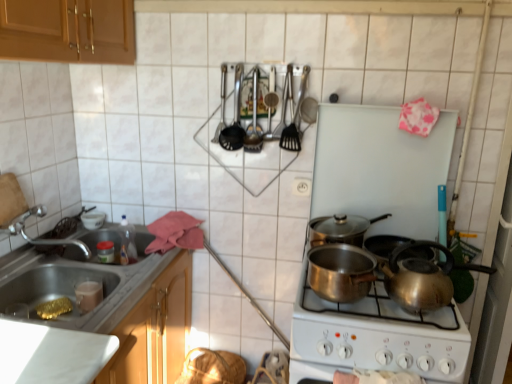
Question: Can you confirm if polished copper pot at center, which ranks as the 2th kitchen appliance in top-to-bottom order, is smaller than metallic cooking utensils at upper center?

Choices:
 (A) yes
 (B) no

Answer: (B)

Question: From a real-world perspective, is polished copper pot at center, which ranks as the 2th kitchen appliance in top-to-bottom order, positioned over metallic cooking utensils at upper center based on gravity?

Choices:
 (A) no
 (B) yes

Answer: (A)

Question: Is polished copper pot at center, the first kitchen appliance ordered from the bottom, not near metallic cooking utensils at upper center?

Choices:
 (A) yes
 (B) no

Answer: (B)

Question: Is polished copper pot at center, which ranks as the 2th kitchen appliance in top-to-bottom order, at the left side of metallic cooking utensils at upper center?

Choices:
 (A) no
 (B) yes

Answer: (A)

Question: Is metallic cooking utensils at upper center a part of polished copper pot at center, the first kitchen appliance ordered from the bottom?

Choices:
 (A) no
 (B) yes

Answer: (A)

Question: Does polished copper pot at center, which ranks as the 2th kitchen appliance in top-to-bottom order, have a greater height compared to metallic cooking utensils at upper center?

Choices:
 (A) no
 (B) yes

Answer: (A)

Question: From the image's perspective, is satin silver kettle at lower right on metallic sink at lower left?

Choices:
 (A) yes
 (B) no

Answer: (B)

Question: Is satin silver kettle at lower right thinner than metallic sink at lower left?

Choices:
 (A) no
 (B) yes

Answer: (A)

Question: From a real-world perspective, is satin silver kettle at lower right below metallic sink at lower left?

Choices:
 (A) no
 (B) yes

Answer: (A)

Question: Considering the relative positions of satin silver kettle at lower right and metallic sink at lower left in the image provided, is satin silver kettle at lower right behind metallic sink at lower left?

Choices:
 (A) no
 (B) yes

Answer: (A)

Question: Does satin silver kettle at lower right have a greater width compared to metallic sink at lower left?

Choices:
 (A) yes
 (B) no

Answer: (A)

Question: From the image's perspective, would you say satin silver kettle at lower right is shown under metallic sink at lower left?

Choices:
 (A) yes
 (B) no

Answer: (A)

Question: Does shiny silver pot at center, which is the second kitchen appliance in bottom-to-top order, have a larger size compared to metallic sink at lower left?

Choices:
 (A) no
 (B) yes

Answer: (A)